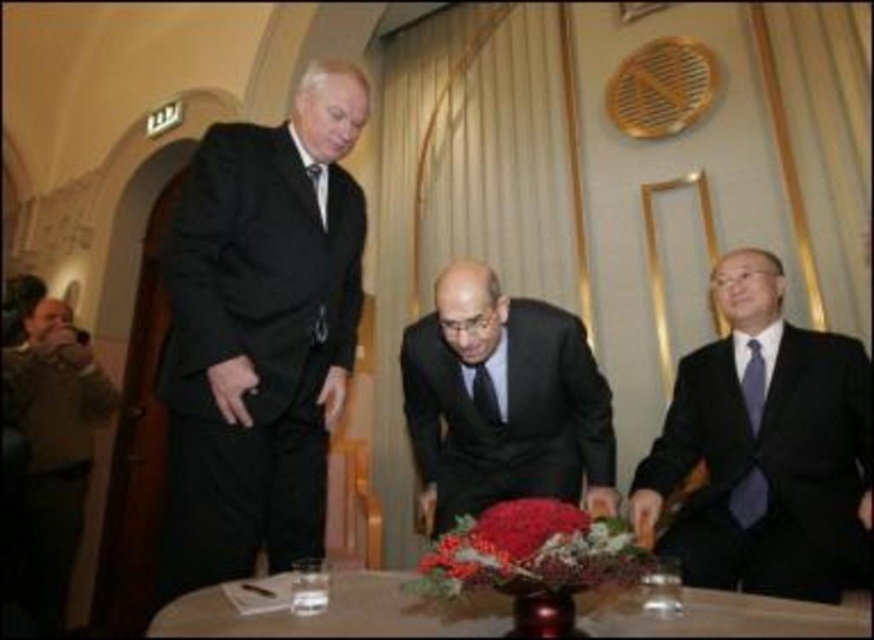
The height and width of the screenshot is (640, 874). What do you see at coordinates (748, 497) in the screenshot?
I see `purple satin tie at right` at bounding box center [748, 497].

Which is below, purple satin tie at right or black silk tie at center?

purple satin tie at right is lower down.

Which is in front, point (764, 374) or point (477, 368)?

Point (477, 368) is in front.

Find the location of a particular element. purple satin tie at right is located at coordinates [x=748, y=497].

Is white glossy table at center positioned before matte black tie at left?

Yes, white glossy table at center is closer to the viewer.

Is white glossy table at center further to camera compared to matte black tie at left?

No, it is in front of matte black tie at left.

Is point (718, 621) positioned behind point (317, 195)?

No, it is in front of (317, 195).

The width and height of the screenshot is (874, 640). Identify the location of white glossy table at center. (341, 612).

Where is `black matte suit at left`? The height and width of the screenshot is (640, 874). black matte suit at left is located at coordinates (258, 333).

Measure the distance between black matte suit at left and purple satin tie at right.

black matte suit at left and purple satin tie at right are 1.36 meters apart.

At what (x,y) coordinates should I click in order to perform the action: click on black matte suit at left. Please return your answer as a coordinate pair (x, y). The image size is (874, 640). Looking at the image, I should click on (258, 333).